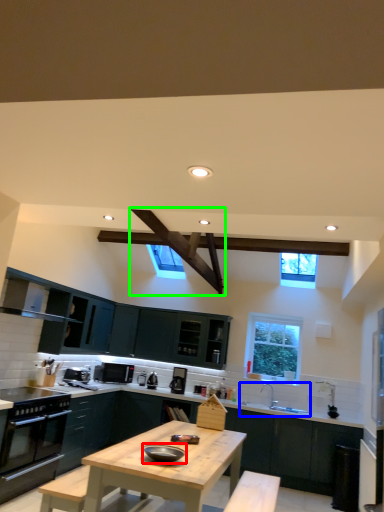
Question: Estimate the real-world distances between objects in this image. Which object is farther from appliance (highlighted by a red box), sink (highlighted by a blue box) or exhaust hood (highlighted by a green box)?

Choices:
 (A) sink
 (B) exhaust hood

Answer: (A)